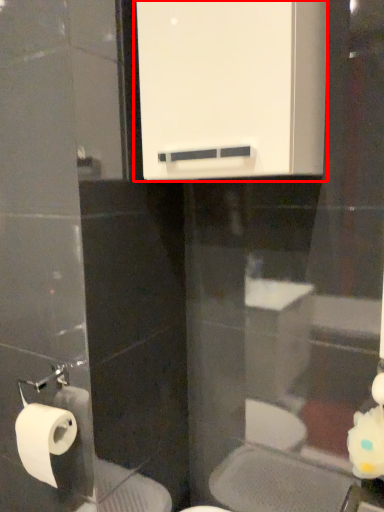
Question: From the image's perspective, what is the correct spatial relationship of medicine cabinet (annotated by the red box) in relation to toilet paper?

Choices:
 (A) above
 (B) below

Answer: (A)